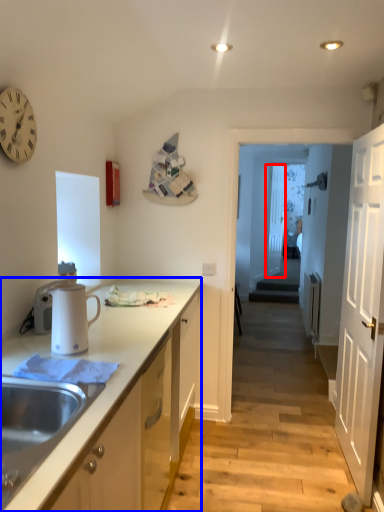
Question: Which object appears farthest to the camera in this image, glass door (highlighted by a red box) or cabinetry (highlighted by a blue box)?

Choices:
 (A) glass door
 (B) cabinetry

Answer: (A)